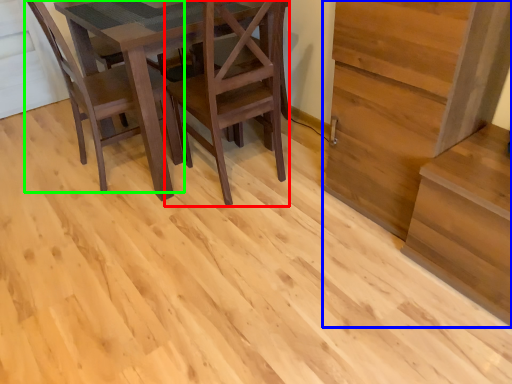
Question: Which object is the closest to the chair (highlighted by a red box)? Choose among these: stairwell (highlighted by a blue box) or chair (highlighted by a green box).

Choices:
 (A) stairwell
 (B) chair

Answer: (B)